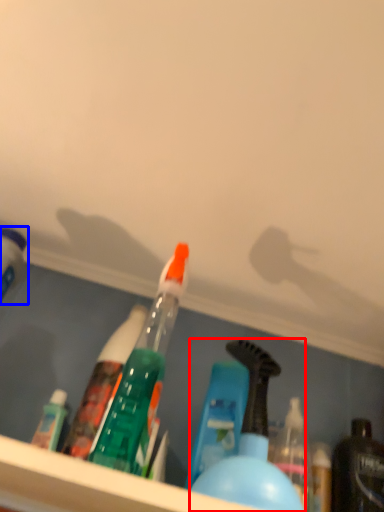
Question: Among these objects, which one is farthest to the camera, bottle (highlighted by a red box) or bottle (highlighted by a blue box)?

Choices:
 (A) bottle
 (B) bottle

Answer: (B)